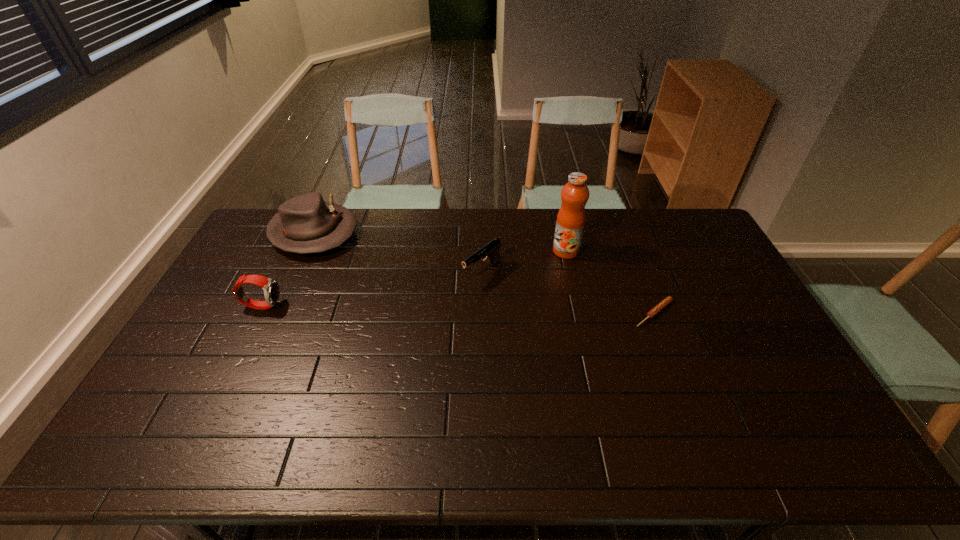
The image size is (960, 540). What are the coordinates of `free space on the desktop that is between the watch and the rightmost object and is positioned on the front label of the tallest object` in the screenshot? It's located at (462, 309).

Locate an element on the screen. This screenshot has height=540, width=960. vacant spot on the desktop that is between the watch and the sausage and is positioned on the decorative side of the hat is located at coordinates (411, 308).

Locate an element on the screen. vacant space on the desktop that is between the watch and the sausage and is positioned at the muzzle of the pistol is located at coordinates (436, 309).